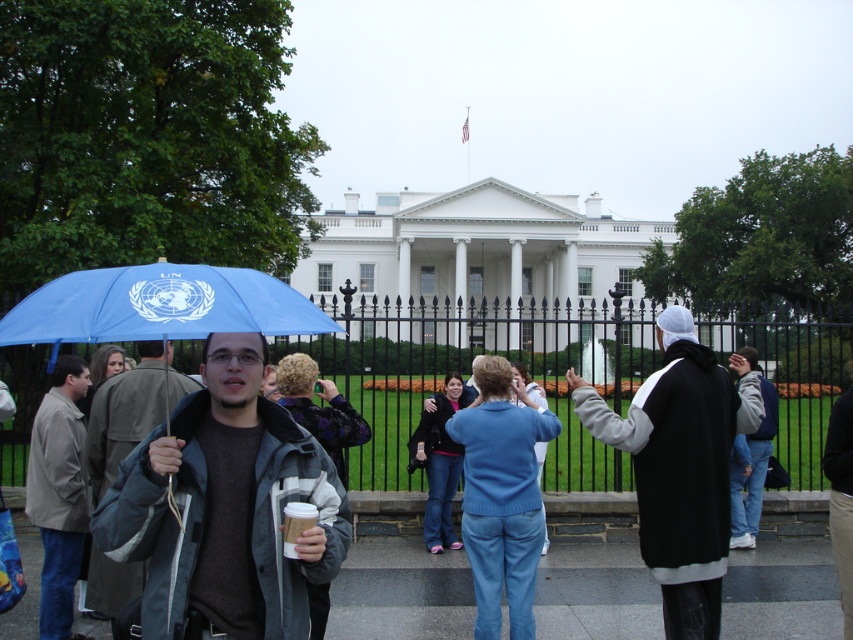
Question: Can you confirm if gray matte jacket at center is bigger than blue matte umbrella at left?

Choices:
 (A) no
 (B) yes

Answer: (A)

Question: Is light brown leather jacket at left closer to camera compared to gray fabric jacket at center?

Choices:
 (A) yes
 (B) no

Answer: (B)

Question: Which object appears farthest from the camera in this image?

Choices:
 (A) blue matte umbrella at left
 (B) black fleece jacket at center

Answer: (B)

Question: Which object appears farthest from the camera in this image?

Choices:
 (A) black fleece jacket at center
 (B) light brown leather jacket at left

Answer: (B)

Question: Can you confirm if black fleece jacket at center is wider than light brown leather jacket at left?

Choices:
 (A) no
 (B) yes

Answer: (B)

Question: Estimate the real-world distances between objects in this image. Which object is closer to the light brown leather jacket at left?

Choices:
 (A) blue matte umbrella at left
 (B) gray fabric jacket at center

Answer: (B)